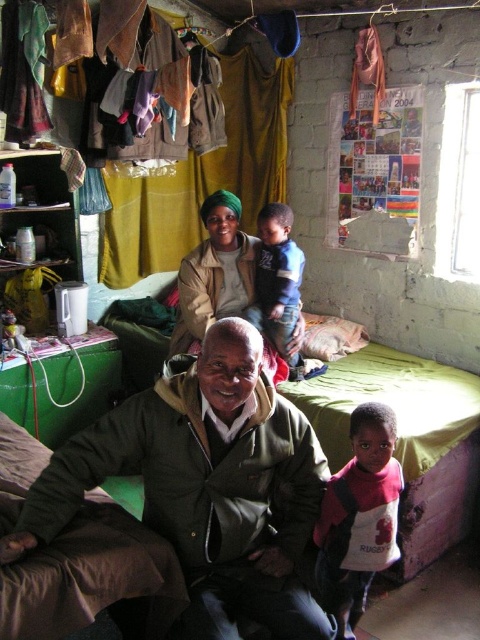
Identify the location of green fabric bed at center. click(407, 440).

Consider the image. Which is more to the left, green fabric bed at center or blue cotton shirt at center?

blue cotton shirt at center

Between point (446, 540) and point (288, 330), which one is positioned in front?

Point (446, 540)

Image resolution: width=480 pixels, height=640 pixels. I want to click on green fabric bed at center, so click(407, 440).

In the scene shown: Can you confirm if green matte jacket at center is thinner than blue cotton shirt at center?

Incorrect, green matte jacket at center's width is not less than blue cotton shirt at center's.

You are a GUI agent. You are given a task and a screenshot of the screen. Output one action in this format:
    pyautogui.click(x=<x>, y=<y>)
    Task: Click on the green matte jacket at center
    The height and width of the screenshot is (640, 480).
    Given the screenshot: What is the action you would take?
    pyautogui.click(x=205, y=484)

Locate an element on the screen. The width and height of the screenshot is (480, 640). green matte jacket at center is located at coordinates (205, 484).

Between point (434, 419) and point (232, 305), which one is positioned behind?

The point (232, 305) is behind.

Does green fabric bed at center have a smaller size compared to matte beige jacket at center?

Incorrect, green fabric bed at center is not smaller in size than matte beige jacket at center.

Which is behind, point (476, 392) or point (227, 301)?

The point (227, 301) is more distant.

The height and width of the screenshot is (640, 480). I want to click on green fabric bed at center, so pyautogui.click(x=407, y=440).